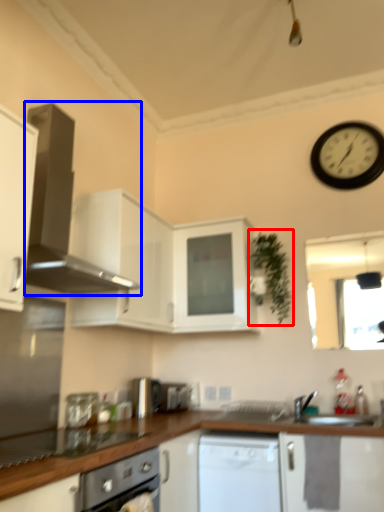
Question: Among these objects, which one is farthest to the camera, plant (highlighted by a red box) or home appliance (highlighted by a blue box)?

Choices:
 (A) plant
 (B) home appliance

Answer: (A)